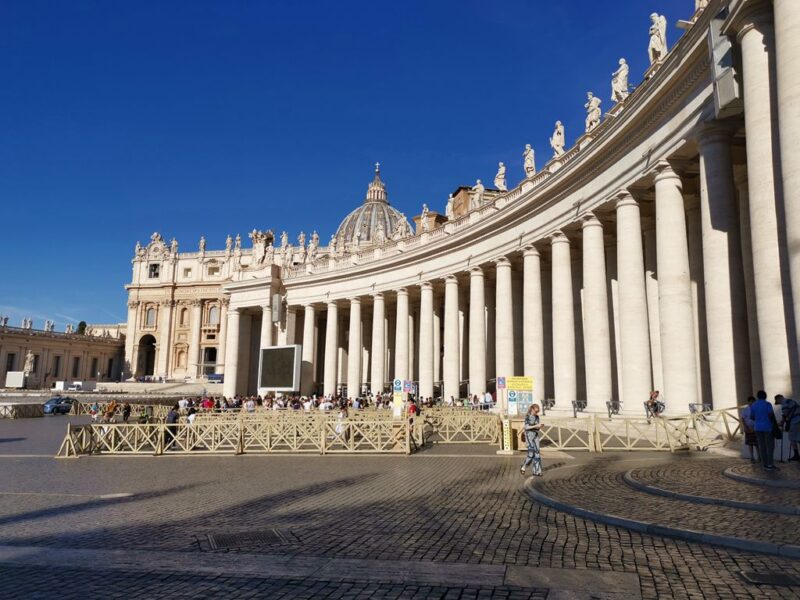
In order to click on arched door to the left in this screenshot , I will do `click(144, 360)`.